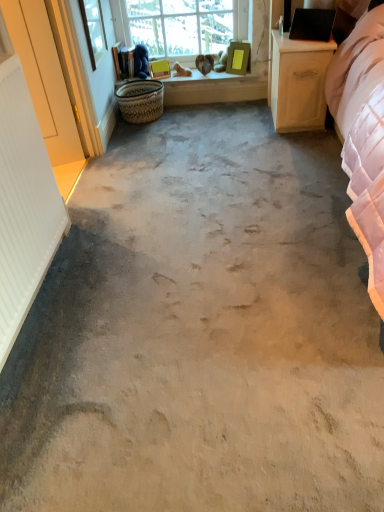
Describe the element at coordinates (212, 80) in the screenshot. I see `wooden window sill at upper center` at that location.

This screenshot has width=384, height=512. What are the coordinates of `clear glass window screen at upper left` in the screenshot? It's located at (94, 30).

The width and height of the screenshot is (384, 512). In order to click on woven natural basket at center in this screenshot , I will do `click(140, 100)`.

What do you see at coordinates (44, 77) in the screenshot?
I see `white wood screen door at left` at bounding box center [44, 77].

Identify the location of light wood/wooden nightstand at right. (299, 82).

Locate an element on the screen. The image size is (384, 512). clear glass window at upper center is located at coordinates (185, 25).

The image size is (384, 512). In order to click on wooden window sill at upper center in this screenshot , I will do 212,80.

Which is closer to the camera, (287, 53) or (90, 58)?

Point (287, 53) is positioned closer to the camera compared to point (90, 58).

Measure the distance from light wood/wooden nightstand at right to clear glass window screen at upper left.

light wood/wooden nightstand at right and clear glass window screen at upper left are 4.29 feet apart from each other.

Between light wood/wooden nightstand at right and clear glass window screen at upper left, which one appears on the right side from the viewer's perspective?

Positioned to the right is light wood/wooden nightstand at right.

Is light wood/wooden nightstand at right not within clear glass window screen at upper left?

Yes, light wood/wooden nightstand at right is located beyond the bounds of clear glass window screen at upper left.

How many degrees apart are the facing directions of white ribbed radiator at left and woven natural basket at center?

The angle between the facing direction of white ribbed radiator at left and the facing direction of woven natural basket at center is 90 degrees.

Which object is closer to the camera, white ribbed radiator at left or woven natural basket at center?

white ribbed radiator at left is more forward.

Measure the distance from white ribbed radiator at left to woven natural basket at center.

They are 1.55 meters apart.

Is white ribbed radiator at left turned away from woven natural basket at center?

No, white ribbed radiator at left's orientation is not away from woven natural basket at center.

Considering the positions of objects wooden window sill at upper center and light wood/wooden nightstand at right in the image provided, who is in front, wooden window sill at upper center or light wood/wooden nightstand at right?

light wood/wooden nightstand at right is closer to the camera.

The height and width of the screenshot is (512, 384). I want to click on nightstand above the wooden window sill at upper center (from a real-world perspective), so click(x=299, y=82).

Between wooden window sill at upper center and light wood/wooden nightstand at right, which one has smaller width?

With smaller width is wooden window sill at upper center.

Is wooden window sill at upper center to the left or to the right of light wood/wooden nightstand at right in the image?

Clearly, wooden window sill at upper center is on the left of light wood/wooden nightstand at right in the image.

Is white ribbed radiator at left taller than light wood/wooden nightstand at right?

Yes, white ribbed radiator at left is taller than light wood/wooden nightstand at right.

Can light wood/wooden nightstand at right be found inside white ribbed radiator at left?

No, white ribbed radiator at left does not contain light wood/wooden nightstand at right.

Looking at this image, can you confirm if white ribbed radiator at left is bigger than light wood/wooden nightstand at right?

No, white ribbed radiator at left is not bigger than light wood/wooden nightstand at right.

Where is `screen door below the clear glass window screen at upper left (from a real-world perspective)`? Image resolution: width=384 pixels, height=512 pixels. screen door below the clear glass window screen at upper left (from a real-world perspective) is located at coordinates (44, 77).

Is point (14, 26) positioned in front of point (99, 29)?

Yes, point (14, 26) is closer to viewer.

Is white wood screen door at left bigger or smaller than clear glass window screen at upper left?

Considering their sizes, white wood screen door at left takes up more space than clear glass window screen at upper left.

From a real-world perspective, is white wood screen door at left beneath clear glass window screen at upper left?

Yes, from a real-world perspective, white wood screen door at left is under clear glass window screen at upper left.

Based on the photo, which is nearer, (x=227, y=82) or (x=5, y=306)?

Clearly, point (x=227, y=82) is more distant from the camera than point (x=5, y=306).

Between wooden window sill at upper center and white ribbed radiator at left, which one has smaller width?

With smaller width is white ribbed radiator at left.

Locate an element on the screen. The height and width of the screenshot is (512, 384). window sill that appears on the right of white ribbed radiator at left is located at coordinates (212, 80).

Is there a large distance between woven natural basket at center and white ribbed radiator at left?

woven natural basket at center is positioned a significant distance from white ribbed radiator at left.

Which point is more forward, (124,112) or (29,276)?

The point (29,276) is closer to the camera.

Between woven natural basket at center and white ribbed radiator at left, which one has larger size?

white ribbed radiator at left is bigger.

Where is `nightstand directly beneath the clear glass window screen at upper left (from a real-world perspective)`? This screenshot has height=512, width=384. nightstand directly beneath the clear glass window screen at upper left (from a real-world perspective) is located at coordinates (299, 82).

At what (x,y) coordinates should I click in order to perform the action: click on radiator above the woven natural basket at center (from a real-world perspective). Please return your answer as a coordinate pair (x, y). Looking at the image, I should click on (24, 205).

Estimate the real-world distances between objects in this image. Which object is closer to clear glass window at upper center, wooden window sill at upper center or woven natural basket at center?

wooden window sill at upper center.

When comparing their distances from white wood screen door at left, does woven natural basket at center or clear glass window at upper center seem closer?

woven natural basket at center.

From the image, which object appears to be farther from light wood/wooden nightstand at right, clear glass window screen at upper left or white wood screen door at left?

white wood screen door at left lies further to light wood/wooden nightstand at right than the other object.

Based on the photo, estimate the real-world distances between objects in this image. Which object is further from wooden window sill at upper center, woven natural basket at center or clear glass window screen at upper left?

clear glass window screen at upper left lies further to wooden window sill at upper center than the other object.

When comparing their distances from clear glass window screen at upper left, does clear glass window at upper center or woven natural basket at center seem closer?

woven natural basket at center is positioned closer to the anchor clear glass window screen at upper left.

Estimate the real-world distances between objects in this image. Which object is further from light wood/wooden nightstand at right, wooden window sill at upper center or white ribbed radiator at left?

white ribbed radiator at left lies further to light wood/wooden nightstand at right than the other object.

From the image, which object appears to be nearer to woven natural basket at center, clear glass window screen at upper left or clear glass window at upper center?

Based on the image, clear glass window screen at upper left appears to be nearer to woven natural basket at center.

Based on the photo, based on their spatial positions, is wooden window sill at upper center or white ribbed radiator at left further from clear glass window at upper center?

Based on the image, white ribbed radiator at left appears to be further to clear glass window at upper center.

Find the location of a particular element. window screen positioned between white ribbed radiator at left and woven natural basket at center from near to far is located at coordinates 94,30.

At what (x,y) coordinates should I click in order to perform the action: click on window sill situated between woven natural basket at center and light wood/wooden nightstand at right from left to right. Please return your answer as a coordinate pair (x, y). The width and height of the screenshot is (384, 512). Looking at the image, I should click on (212, 80).

You are a GUI agent. You are given a task and a screenshot of the screen. Output one action in this format:
    pyautogui.click(x=<x>, y=<y>)
    Task: Click on the radiator between white wood screen door at left and light wood/wooden nightstand at right from left to right
    Image resolution: width=384 pixels, height=512 pixels.
    Given the screenshot: What is the action you would take?
    pyautogui.click(x=24, y=205)

You are a GUI agent. You are given a task and a screenshot of the screen. Output one action in this format:
    pyautogui.click(x=<x>, y=<y>)
    Task: Click on the window sill between clear glass window at upper center and woven natural basket at center vertically
    This screenshot has width=384, height=512.
    Given the screenshot: What is the action you would take?
    pyautogui.click(x=212, y=80)